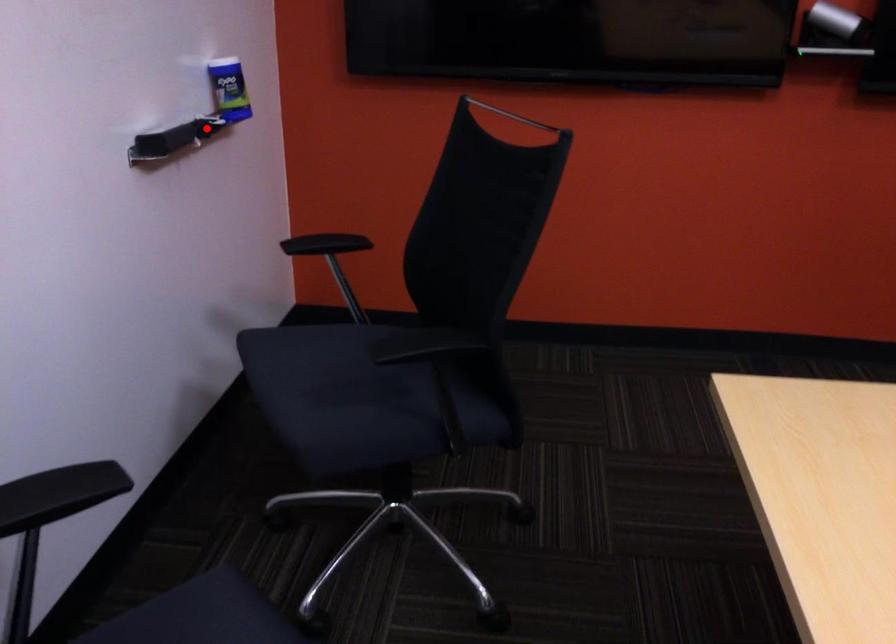
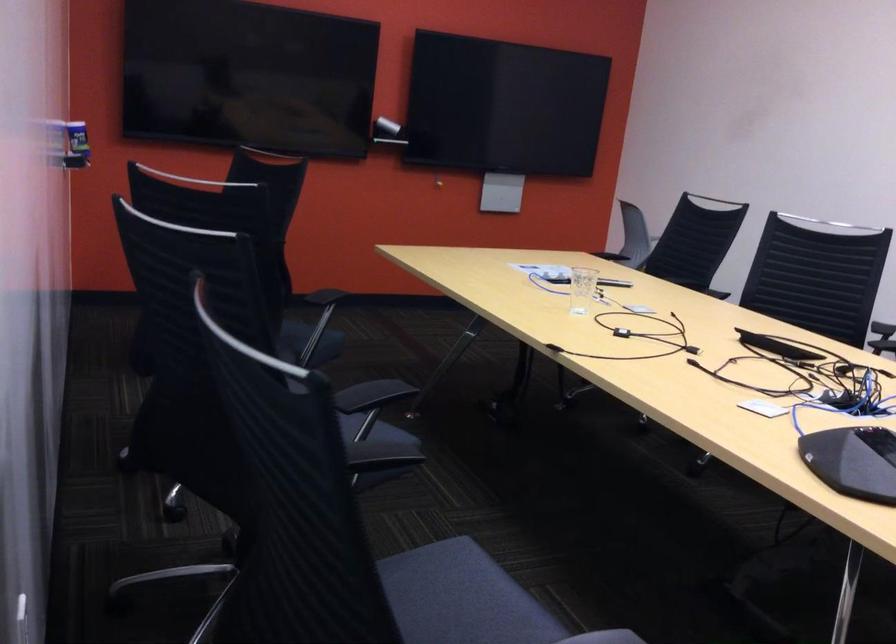
Question: A red point is marked in image1. In image2, is the corresponding 3D point closer to the camera or farther? Reply with the corresponding letter.

Choices:
 (A) The corresponding 3D point is closer.
 (B) The corresponding 3D point is farther.

Answer: (B)